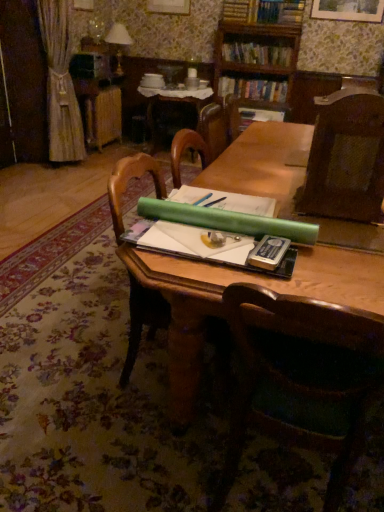
The height and width of the screenshot is (512, 384). Describe the element at coordinates (257, 54) in the screenshot. I see `hardcover book at upper center, acting as the 1th book starting from the top` at that location.

Find the location of a particular element. This screenshot has height=512, width=384. wooden table at center, the 2th table from the back is located at coordinates (243, 281).

How different are the orientations of hardcover book at upper center, acting as the 1th book starting from the top, and wooden table at center, the first table when ordered from back to front, in degrees?

The angular difference between hardcover book at upper center, acting as the 1th book starting from the top, and wooden table at center, the first table when ordered from back to front, is 0.13 degrees.

Can you confirm if hardcover book at upper center, acting as the 1th book starting from the top, is thinner than wooden table at center, positioned as the second table in front-to-back order?

Yes, hardcover book at upper center, acting as the 1th book starting from the top, is thinner than wooden table at center, positioned as the second table in front-to-back order.

Is hardcover book at upper center, marked as the second book in a bottom-to-top arrangement, oriented away from wooden table at center, the 1th table when ordered from top to bottom?

No, hardcover book at upper center, marked as the second book in a bottom-to-top arrangement,'s orientation is not away from wooden table at center, the 1th table when ordered from top to bottom.

Is there a large distance between hardcover book at upper center, marked as the second book in a bottom-to-top arrangement, and wooden table at center, positioned as the second table in front-to-back order?

No, hardcover book at upper center, marked as the second book in a bottom-to-top arrangement, is in close proximity to wooden table at center, positioned as the second table in front-to-back order.

Which object is thinner, wooden table at center, marked as the 1th table in a bottom-to-top arrangement, or matte white lampshade at upper left?

matte white lampshade at upper left is thinner.

Could you tell me if wooden table at center, marked as the 1th table in a bottom-to-top arrangement, is facing matte white lampshade at upper left?

No, wooden table at center, marked as the 1th table in a bottom-to-top arrangement, is not facing towards matte white lampshade at upper left.

Locate an element on the screen. The height and width of the screenshot is (512, 384). table lamp that appears behind the wooden table at center, which ranks as the 1th table in front-to-back order is located at coordinates (118, 42).

Measure the distance between wooden table at center, which ranks as the 1th table in front-to-back order, and matte white lampshade at upper left.

The distance of wooden table at center, which ranks as the 1th table in front-to-back order, from matte white lampshade at upper left is 9.73 feet.

Is wooden table at center, the first table when ordered from back to front, turned away from hardcover book at upper center, acting as the 1th book starting from the top?

No, hardcover book at upper center, acting as the 1th book starting from the top, is not at the back of wooden table at center, the first table when ordered from back to front.

How different are the orientations of wooden table at center, the first table when ordered from back to front, and hardcover book at upper center, marked as the second book in a bottom-to-top arrangement, in degrees?

wooden table at center, the first table when ordered from back to front, and hardcover book at upper center, marked as the second book in a bottom-to-top arrangement, are facing 0.13 degrees away from each other.

Is wooden table at center, placed as the second table when sorted from bottom to top, taller or shorter than hardcover book at upper center, acting as the 1th book starting from the top?

Clearly, wooden table at center, placed as the second table when sorted from bottom to top, is taller compared to hardcover book at upper center, acting as the 1th book starting from the top.

Considering the positions of objects wooden table at center, positioned as the second table in front-to-back order, and hardcover book at upper center, acting as the 1th book starting from the top, in the image provided, who is in front, wooden table at center, positioned as the second table in front-to-back order, or hardcover book at upper center, acting as the 1th book starting from the top,?

wooden table at center, positioned as the second table in front-to-back order.

Which is in front, point (364, 115) or point (377, 5)?

The point (364, 115) is more forward.

Is brown textured chair at right, the first chair from the top, far away from wooden picture frame at upper center?

Yes, brown textured chair at right, the first chair from the top, and wooden picture frame at upper center are located far from each other.

Between brown textured chair at right, the first chair from the top, and wooden picture frame at upper center, which one has larger size?

brown textured chair at right, the first chair from the top.

Which object is closer to the camera, brown textured chair at right, the first chair from the top, or wooden picture frame at upper center?

brown textured chair at right, the first chair from the top.

How different are the orientations of wooden table at center, positioned as the second table in front-to-back order, and brown textured chair at right, which is counted as the 2th chair, starting from the bottom, in degrees?

The angular difference between wooden table at center, positioned as the second table in front-to-back order, and brown textured chair at right, which is counted as the 2th chair, starting from the bottom, is 94 degrees.

Between wooden table at center, positioned as the second table in front-to-back order, and brown textured chair at right, the first chair from the top, which one has smaller size?

Smaller between the two is brown textured chair at right, the first chair from the top.

Is wooden table at center, placed as the second table when sorted from bottom to top, directly adjacent to brown textured chair at right, which is counted as the 2th chair, starting from the bottom?

No, wooden table at center, placed as the second table when sorted from bottom to top, is not next to brown textured chair at right, which is counted as the 2th chair, starting from the bottom.

Based on the photo, can you confirm if wooden table at center, placed as the second table when sorted from bottom to top, is positioned to the left of brown textured chair at right, which is counted as the 2th chair, starting from the bottom?

Yes.

From the hardcover book at upper center, marked as the second book in a top-to-bottom arrangement, count the 2nd chair to the left and point to it. Please provide its 2D coordinates.

[(302, 377)]

Is point (283, 330) positioned in front of point (227, 92)?

Yes, it is in front of point (227, 92).

Consider the image. Between wooden chair at center, the 2th chair from the top, and hardcover book at upper center, positioned as the first book in bottom-to-top order, which one has less height?

Standing shorter between the two is hardcover book at upper center, positioned as the first book in bottom-to-top order.

Are wooden chair at center, the 2th chair from the top, and hardcover book at upper center, positioned as the first book in bottom-to-top order, far apart?

Yes, wooden chair at center, the 2th chair from the top, is far from hardcover book at upper center, positioned as the first book in bottom-to-top order.

Would you say wooden bookcase at upper center is to the left or to the right of metallic silver paperback book at center in the picture?

wooden bookcase at upper center is positioned on metallic silver paperback book at center's right side.

In terms of height, does wooden bookcase at upper center look taller or shorter compared to metallic silver paperback book at center?

wooden bookcase at upper center is taller than metallic silver paperback book at center.

From a real-world perspective, is wooden bookcase at upper center positioned above or below metallic silver paperback book at center?

wooden bookcase at upper center is above metallic silver paperback book at center.

Is point (226, 0) positioned before point (270, 257)?

No, (226, 0) is behind (270, 257).

Identify the location of the 1st book behind the wooden table at center, placed as the second table when sorted from bottom to top. 257,54.

In the image, there is a wooden table at center, which ranks as the 1th table in front-to-back order. Identify the location of table lamp above it (from the image's perspective). (118, 42).

Looking at the image, which one is located closer to wooden bookcase at upper center, wooden table at center, which appears as the 2th table when viewed from the top, or gold textured curtain at left?

gold textured curtain at left is closer to wooden bookcase at upper center.

In the scene shown: Which object lies further to the anchor point matte white lampshade at upper left, metallic silver paperback book at center or hardcover book at upper center, marked as the second book in a bottom-to-top arrangement?

Based on the image, metallic silver paperback book at center appears to be further to matte white lampshade at upper left.

Consider the image. Estimate the real-world distances between objects in this image. Which object is further from wooden bookcase at upper center, hardcover book at upper center, marked as the second book in a bottom-to-top arrangement, or metallic silver paperback book at center?

Among the two, metallic silver paperback book at center is located further to wooden bookcase at upper center.

From the image, which object appears to be nearer to gold textured curtain at left, wooden picture frame at upper center or wooden table at center, the 1th table when ordered from top to bottom?

wooden table at center, the 1th table when ordered from top to bottom, is positioned closer to the anchor gold textured curtain at left.

Consider the image. Based on their spatial positions, is wooden table at center, positioned as the second table in front-to-back order, or gold textured curtain at left closer to brown textured chair at right, which is counted as the 2th chair, starting from the bottom?

wooden table at center, positioned as the second table in front-to-back order, lies closer to brown textured chair at right, which is counted as the 2th chair, starting from the bottom, than the other object.

Looking at the image, which one is located closer to wooden table at center, the 2th table from the back, hardcover book at upper center, marked as the second book in a top-to-bottom arrangement, or wooden table at center, placed as the second table when sorted from bottom to top?

Based on the image, wooden table at center, placed as the second table when sorted from bottom to top, appears to be nearer to wooden table at center, the 2th table from the back.

Estimate the real-world distances between objects in this image. Which object is closer to wooden picture frame at upper center, gold textured curtain at left or wooden table at center, marked as the 1th table in a bottom-to-top arrangement?

Among the two, wooden table at center, marked as the 1th table in a bottom-to-top arrangement, is located nearer to wooden picture frame at upper center.

Estimate the real-world distances between objects in this image. Which object is further from hardcover book at upper center, acting as the 1th book starting from the top, metallic silver paperback book at center or wooden bookcase at upper center?

metallic silver paperback book at center lies further to hardcover book at upper center, acting as the 1th book starting from the top, than the other object.

At what (x,y) coordinates should I click in order to perform the action: click on table between brown textured chair at right, which is counted as the 2th chair, starting from the bottom, and hardcover book at upper center, marked as the second book in a top-to-bottom arrangement, in the front-back direction. Please return your answer as a coordinate pair (x, y). Looking at the image, I should click on (174, 99).

The height and width of the screenshot is (512, 384). I want to click on picture frame between metallic silver paperback book at center and wooden bookcase at upper center along the z-axis, so click(x=348, y=10).

At what (x,y) coordinates should I click in order to perform the action: click on chair between wooden table at center, marked as the 1th table in a bottom-to-top arrangement, and wooden bookcase at upper center, along the z-axis. Please return your answer as a coordinate pair (x, y). This screenshot has height=512, width=384. Looking at the image, I should click on (346, 158).

Where is `paperback book between brown textured chair at right, which is counted as the 2th chair, starting from the bottom, and wooden chair at center, the 2th chair from the top, vertically`? This screenshot has width=384, height=512. paperback book between brown textured chair at right, which is counted as the 2th chair, starting from the bottom, and wooden chair at center, the 2th chair from the top, vertically is located at coordinates (268, 252).